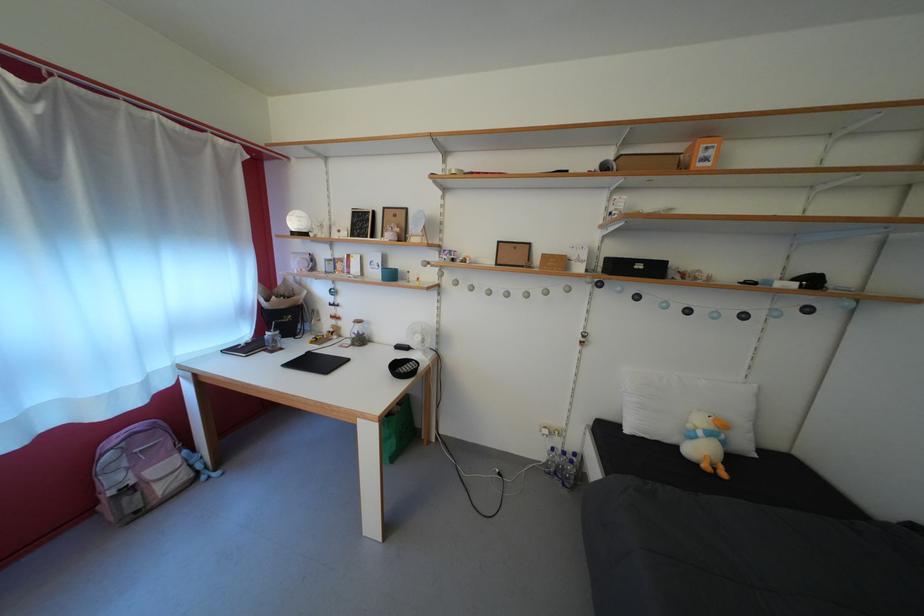
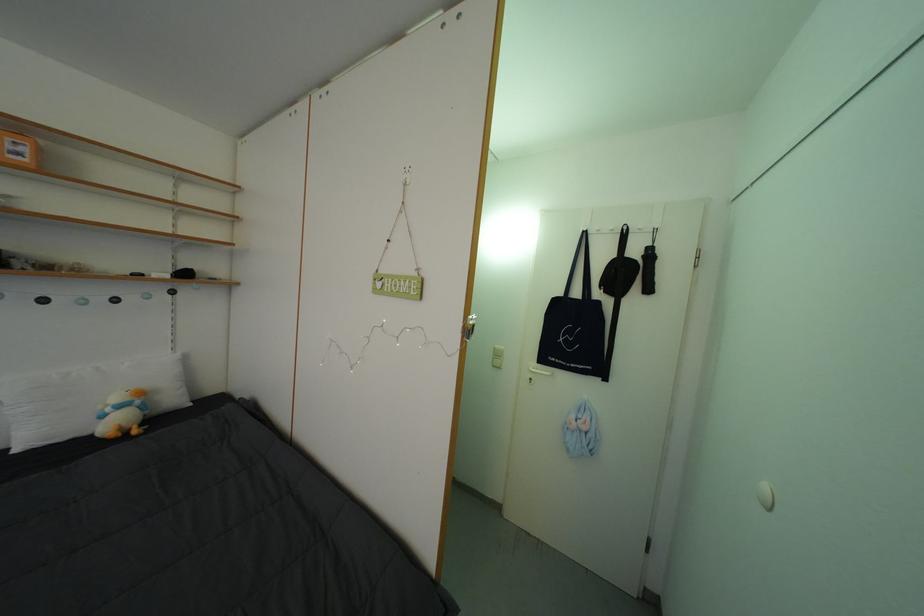
Where in the second image is the point corresponding to (x=709, y=439) from the first image?

(117, 415)